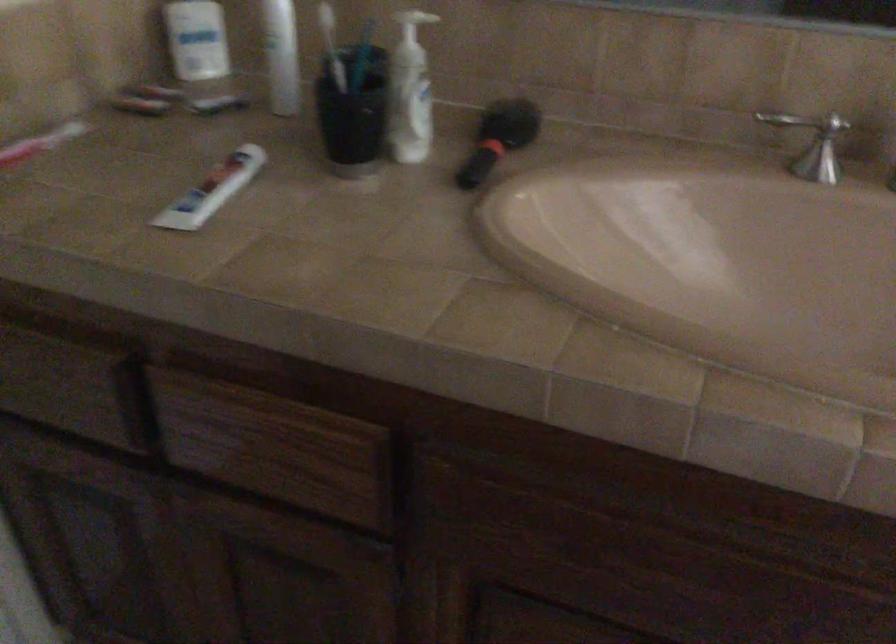
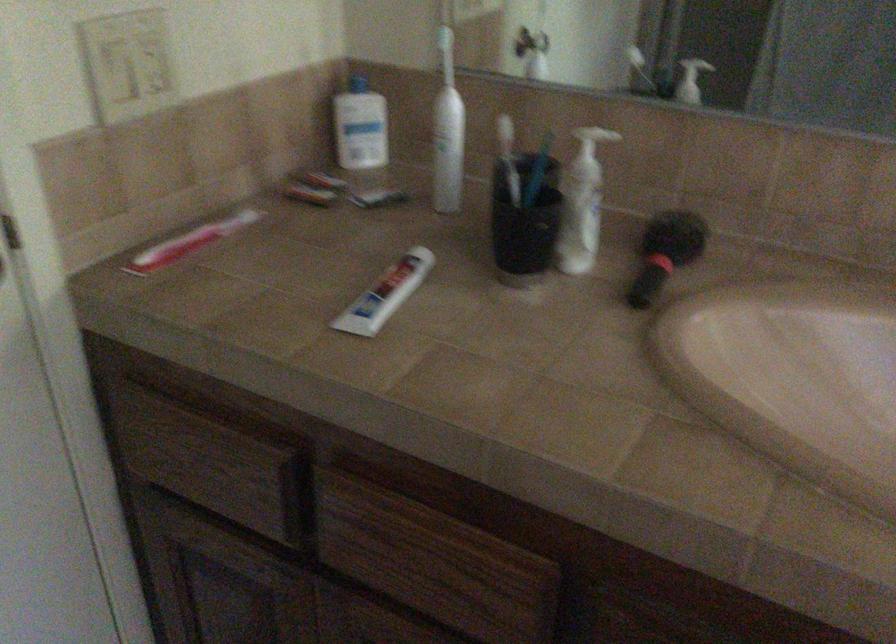
In the second image, find the point that corresponds to [405,114] in the first image.

(579, 225)